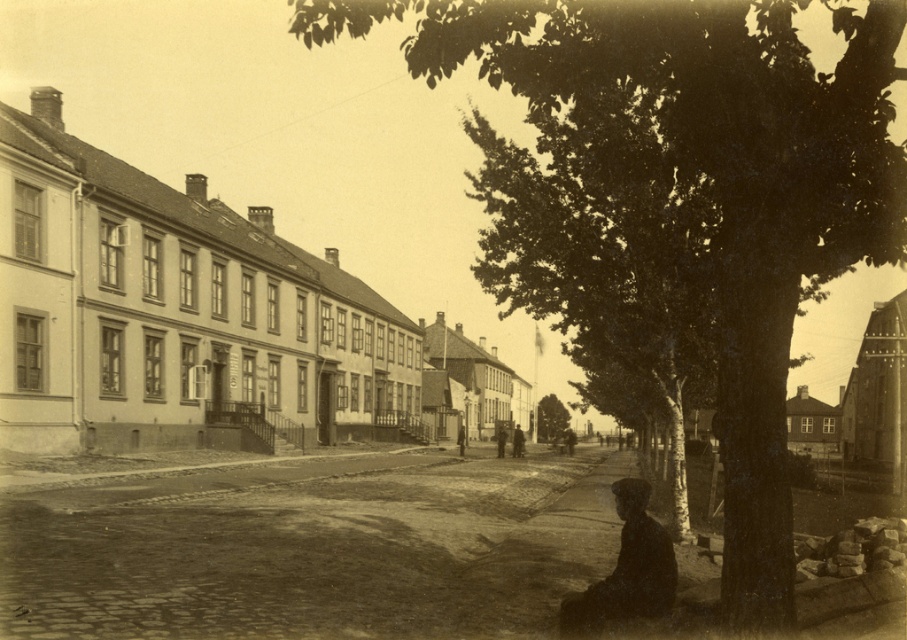
You are a photographer standing on the street and want to take a photo that includes both the smooth bark tree at center and the dark green textured tree at center. Which tree will appear larger in the photo?

The smooth bark tree at center will appear larger in the photo because it is closer to the viewer than the dark green textured tree at center.

You are an urban planner assessing the width of trees in a historic district. You observe the smooth bark tree at center and the dark green textured tree at center. Which tree has a greater width?

The smooth bark tree at center has a greater width than the dark green textured tree at center.

You are an architect analyzing the layout of this historic street. Based on the image, which tree, the smooth bark tree at center or the green leafy tree at center, is positioned higher in the scene?

The smooth bark tree at center is positioned higher than the green leafy tree at center in the scene.